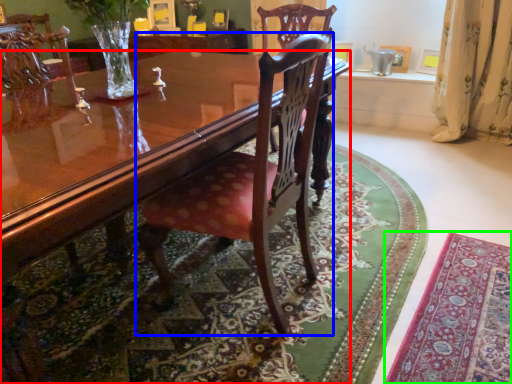
Question: Which object is positioned farthest from coffee table (highlighted by a red box)? Select from chair (highlighted by a blue box) and mat (highlighted by a green box).

Choices:
 (A) chair
 (B) mat

Answer: (B)